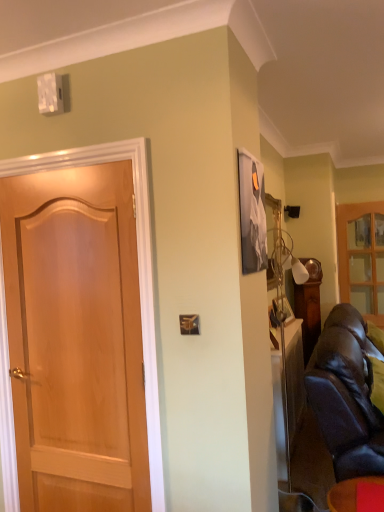
In order to face matte black leather couch at lower right, should I rotate leftwards or rightwards?

You should rotate right by 23.667 degrees.

What is the approximate width of matte black leather couch at lower right?

matte black leather couch at lower right is 11.88 inches in width.

Where is `wooden glass cabinet at right`? The width and height of the screenshot is (384, 512). wooden glass cabinet at right is located at coordinates (362, 257).

Considering the sizes of wooden glass cabinet at right and light brown wood door at left in the image, is wooden glass cabinet at right taller or shorter than light brown wood door at left?

Considering their sizes, wooden glass cabinet at right has less height than light brown wood door at left.

Between wooden glass cabinet at right and light brown wood door at left, which one has larger size?

light brown wood door at left.

Locate an element on the screen. Image resolution: width=384 pixels, height=512 pixels. door that appears below the wooden glass cabinet at right (from the image's perspective) is located at coordinates tap(77, 328).

Which object is closer to the camera, light brown wood door at left or wooden glass cabinet at right?

light brown wood door at left is closer to the camera.

Is light brown wood door at left positioned with its back to wooden glass cabinet at right?

Yes, wooden glass cabinet at right is at the back of light brown wood door at left.

Does point (19, 281) appear closer or farther from the camera than point (369, 306)?

Point (19, 281) is closer to the camera than point (369, 306).

Is leather couch at right oriented towards matte black leather couch at lower right?

No, leather couch at right does not turn towards matte black leather couch at lower right.

Which of these two, leather couch at right or matte black leather couch at lower right, stands shorter?

matte black leather couch at lower right is shorter.

Is leather couch at right positioned far away from matte black leather couch at lower right?

leather couch at right is near matte black leather couch at lower right, not far away.

Where is `cabinetry located above the leather couch at right (from the image's perspective)`? Image resolution: width=384 pixels, height=512 pixels. cabinetry located above the leather couch at right (from the image's perspective) is located at coordinates (362, 257).

Which is further, (x=341, y=300) or (x=338, y=434)?

The point (x=341, y=300) is behind.

From the picture: How different are the orientations of wooden glass cabinet at right and leather couch at right in degrees?

The facing directions of wooden glass cabinet at right and leather couch at right are 91.3 degrees apart.

Is leather couch at right located within wooden glass cabinet at right?

No.

Between matte black leather couch at lower right and leather couch at right, which one has smaller width?

Thinner between the two is matte black leather couch at lower right.

Between matte black leather couch at lower right and leather couch at right, which one appears on the left side from the viewer's perspective?

Positioned to the left is matte black leather couch at lower right.

Is matte black leather couch at lower right not within leather couch at right?

Absolutely, matte black leather couch at lower right is external to leather couch at right.

Is light brown wood door at left surrounded by matte black leather couch at lower right?

No, matte black leather couch at lower right does not contain light brown wood door at left.

Image resolution: width=384 pixels, height=512 pixels. I want to click on furniture below the light brown wood door at left (from the image's perspective), so click(350, 494).

What's the angular difference between matte black leather couch at lower right and light brown wood door at left's facing directions?

0.797 degrees separate the facing orientations of matte black leather couch at lower right and light brown wood door at left.

Which object is closer to the camera taking this photo, matte black leather couch at lower right or light brown wood door at left?

Positioned in front is matte black leather couch at lower right.

Are wooden glass cabinet at right and matte black leather couch at lower right beside each other?

wooden glass cabinet at right and matte black leather couch at lower right are clearly separated.

In the scene shown: Considering the sizes of wooden glass cabinet at right and matte black leather couch at lower right in the image, is wooden glass cabinet at right bigger or smaller than matte black leather couch at lower right?

In the image, wooden glass cabinet at right appears to be larger than matte black leather couch at lower right.

In terms of width, does wooden glass cabinet at right look wider or thinner when compared to matte black leather couch at lower right?

In the image, wooden glass cabinet at right appears to be more narrow than matte black leather couch at lower right.

Is wooden glass cabinet at right facing towards matte black leather couch at lower right?

Yes, wooden glass cabinet at right is oriented towards matte black leather couch at lower right.

Where is `cabinetry lying behind the light brown wood door at left`? The width and height of the screenshot is (384, 512). cabinetry lying behind the light brown wood door at left is located at coordinates (362, 257).

Identify the location of door in front of the wooden glass cabinet at right. The width and height of the screenshot is (384, 512). (77, 328).

Estimate the real-world distances between objects in this image. Which object is closer to leather couch at right, matte black leather couch at lower right or wooden glass cabinet at right?

The object closer to leather couch at right is matte black leather couch at lower right.

Which object lies further to the anchor point light brown wood door at left, wooden glass cabinet at right or leather couch at right?

wooden glass cabinet at right lies further to light brown wood door at left than the other object.

When comparing their distances from leather couch at right, does matte black leather couch at lower right or light brown wood door at left seem further?

light brown wood door at left.

When comparing their distances from matte black leather couch at lower right, does wooden glass cabinet at right or leather couch at right seem further?

Among the two, wooden glass cabinet at right is located further to matte black leather couch at lower right.

Looking at the image, which one is located further to leather couch at right, wooden glass cabinet at right or matte black leather couch at lower right?

The object further to leather couch at right is wooden glass cabinet at right.

When comparing their distances from wooden glass cabinet at right, does leather couch at right or light brown wood door at left seem closer?

leather couch at right is closer to wooden glass cabinet at right.

Looking at the image, which one is located closer to wooden glass cabinet at right, light brown wood door at left or matte black leather couch at lower right?

Among the two, matte black leather couch at lower right is located nearer to wooden glass cabinet at right.

Estimate the real-world distances between objects in this image. Which object is further from leather couch at right, light brown wood door at left or wooden glass cabinet at right?

Based on the image, wooden glass cabinet at right appears to be further to leather couch at right.

Locate an element on the screen. studio couch between matte black leather couch at lower right and wooden glass cabinet at right along the z-axis is located at coordinates (346, 395).

This screenshot has height=512, width=384. I want to click on door between matte black leather couch at lower right and wooden glass cabinet at right along the z-axis, so click(77, 328).

Image resolution: width=384 pixels, height=512 pixels. Find the location of `furniture between light brown wood door at left and leather couch at right from left to right`. furniture between light brown wood door at left and leather couch at right from left to right is located at coordinates (x=350, y=494).

Locate an element on the screen. studio couch between light brown wood door at left and wooden glass cabinet at right from front to back is located at coordinates (346, 395).